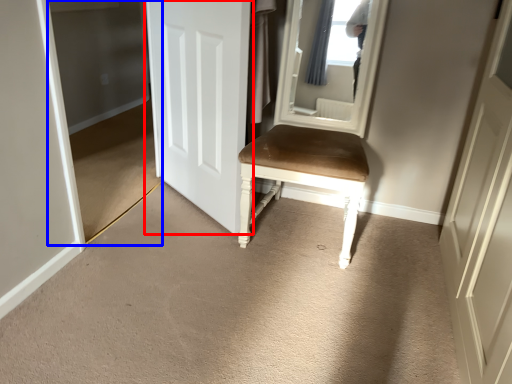
Question: Among these objects, which one is nearest to the camera, door (highlighted by a red box) or glass door (highlighted by a blue box)?

Choices:
 (A) door
 (B) glass door

Answer: (B)